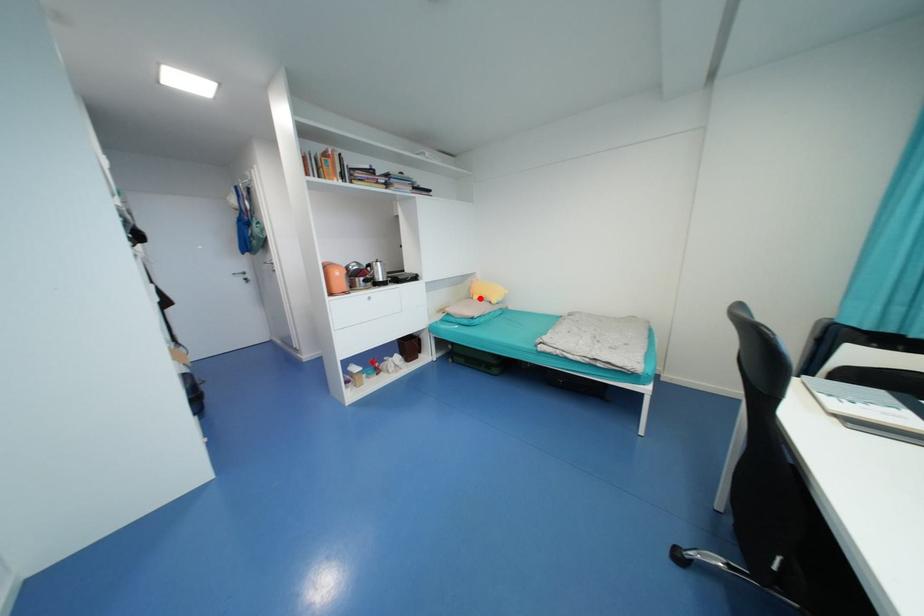
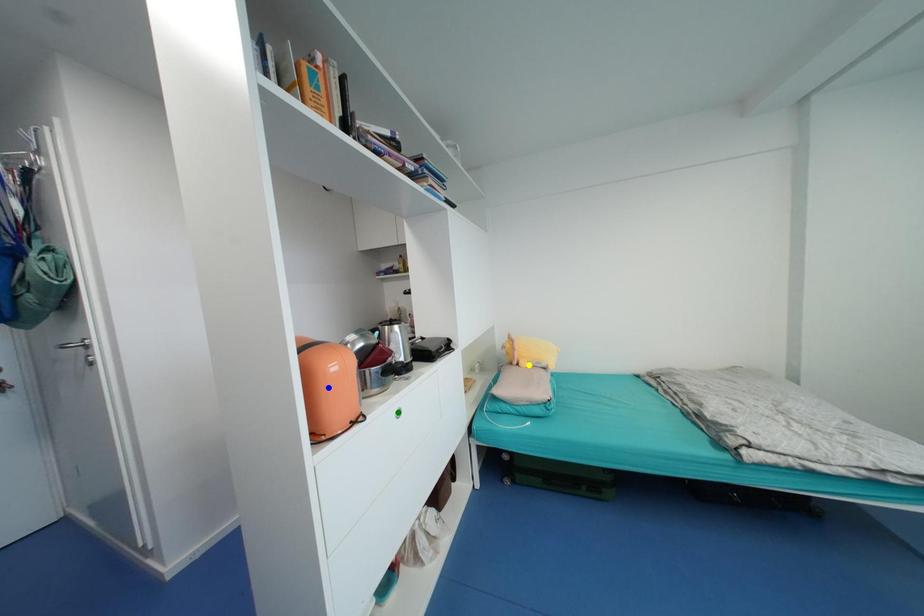
Question: I am providing you with two images of the same scene from different viewpoints. A red point is marked on the first image. You are given multiple points on the second image. Which point in image 2 represents the same 3d spot as the red point in image 1?

Choices:
 (A) blue point
 (B) green point
 (C) yellow point

Answer: (C)